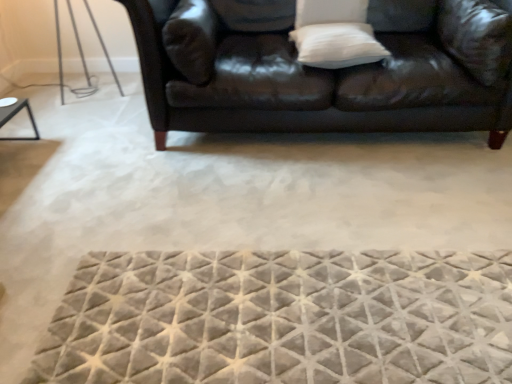
Image resolution: width=512 pixels, height=384 pixels. Find the location of `vacant area in front of leather couch at upper center`. vacant area in front of leather couch at upper center is located at coordinates [x=300, y=236].